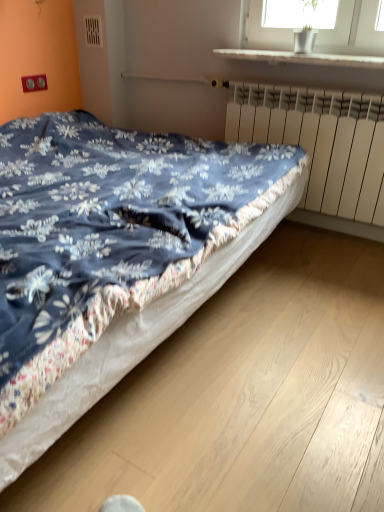
Question: Is blue floral fabric bed at center positioned with its back to white matte radiator at right?

Choices:
 (A) yes
 (B) no

Answer: (B)

Question: Is blue floral fabric bed at center surrounding white matte radiator at right?

Choices:
 (A) yes
 (B) no

Answer: (B)

Question: From a real-world perspective, is blue floral fabric bed at center on top of white matte radiator at right?

Choices:
 (A) no
 (B) yes

Answer: (A)

Question: Is the depth of blue floral fabric bed at center greater than that of white matte radiator at right?

Choices:
 (A) yes
 (B) no

Answer: (B)

Question: Is blue floral fabric bed at center aimed at white matte radiator at right?

Choices:
 (A) no
 (B) yes

Answer: (A)

Question: Which is correct: white matte radiator at right is inside white glossy window sill at upper center, or outside of it?

Choices:
 (A) outside
 (B) inside

Answer: (A)

Question: From the image's perspective, is white matte radiator at right above or below white glossy window sill at upper center?

Choices:
 (A) below
 (B) above

Answer: (A)

Question: Does point (230, 112) appear closer or farther from the camera than point (243, 58)?

Choices:
 (A) farther
 (B) closer

Answer: (A)

Question: Relative to white glossy window sill at upper center, is white matte radiator at right in front or behind?

Choices:
 (A) front
 (B) behind

Answer: (B)

Question: Is blue floral fabric bed at center to the left or to the right of white glossy window sill at upper center in the image?

Choices:
 (A) right
 (B) left

Answer: (B)

Question: From the image's perspective, is blue floral fabric bed at center located above or below white glossy window sill at upper center?

Choices:
 (A) below
 (B) above

Answer: (A)

Question: From a real-world perspective, is blue floral fabric bed at center positioned above or below white glossy window sill at upper center?

Choices:
 (A) below
 (B) above

Answer: (A)

Question: Is blue floral fabric bed at center inside the boundaries of white glossy window sill at upper center, or outside?

Choices:
 (A) outside
 (B) inside

Answer: (A)

Question: From the image's perspective, is white glossy window sill at upper center located above or below white matte radiator at right?

Choices:
 (A) above
 (B) below

Answer: (A)

Question: From a real-world perspective, relative to white matte radiator at right, is white glossy window sill at upper center vertically above or below?

Choices:
 (A) below
 (B) above

Answer: (B)